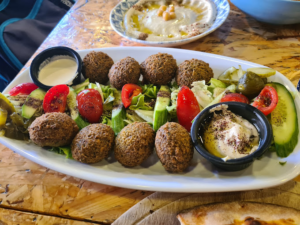
At what (x,y) coordinates should I click in order to perform the action: click on ramekin. Please return your answer as a coordinate pair (x, y). This screenshot has width=300, height=225. Looking at the image, I should click on (211, 155), (45, 53).